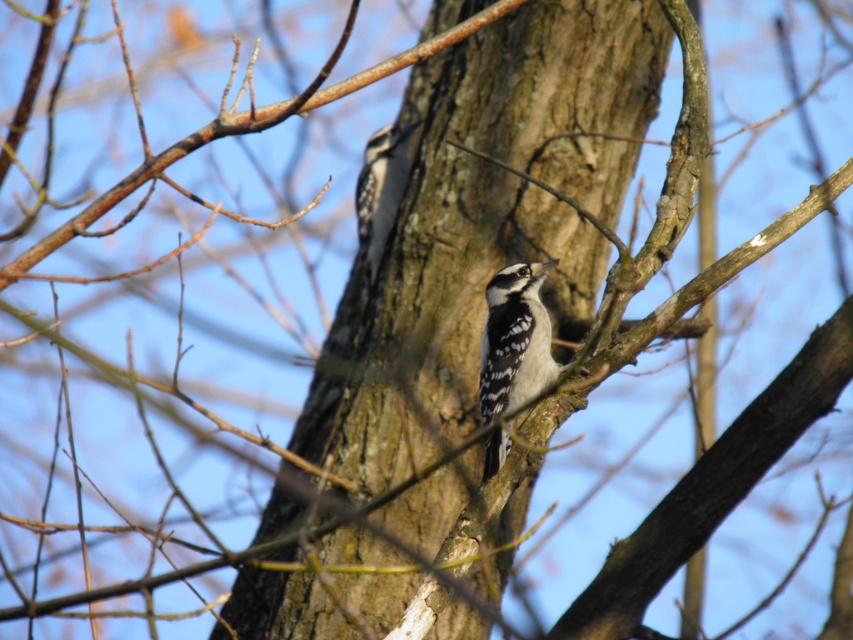
Who is more distant from viewer, (163, 164) or (386, 156)?

Positioned behind is point (386, 156).

Does brown rough bark at center have a greater height compared to speckled brown woodpecker at center?

No.

Identify the location of brown rough bark at center. (248, 129).

Which is more to the left, white speckled woodpecker at center or speckled brown woodpecker at center?

Positioned to the left is speckled brown woodpecker at center.

Which is above, white speckled woodpecker at center or speckled brown woodpecker at center?

Positioned higher is speckled brown woodpecker at center.

Is point (483, 339) closer to camera compared to point (376, 204)?

Yes.

Find the location of a particular element. The height and width of the screenshot is (640, 853). white speckled woodpecker at center is located at coordinates (515, 340).

Which of these two, brown rough bark at center or white speckled woodpecker at center, stands taller?

With more height is white speckled woodpecker at center.

Between point (210, 134) and point (515, 344), which one is positioned behind?

The point (515, 344) is behind.

Locate an element on the screen. The height and width of the screenshot is (640, 853). brown rough bark at center is located at coordinates (248, 129).